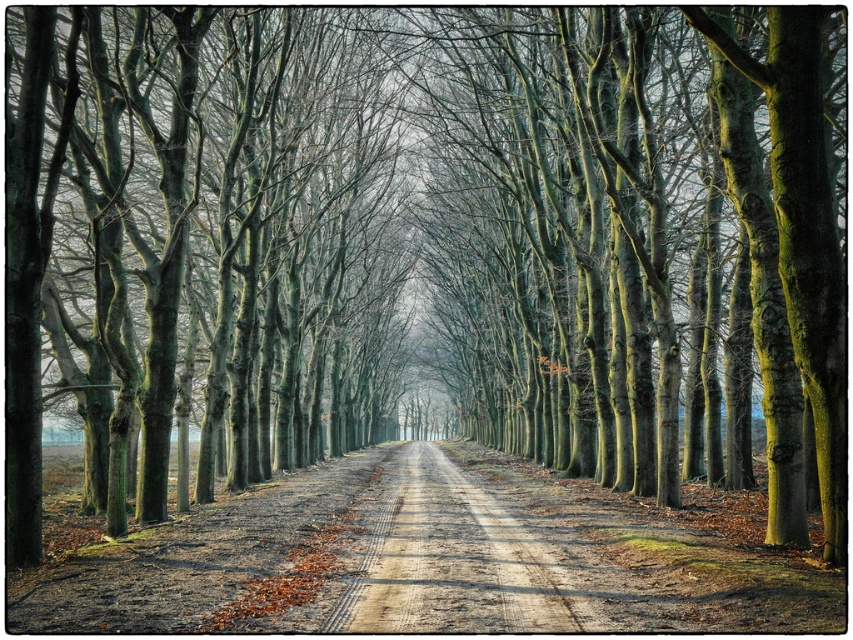
You are standing on the tree lined path and want to walk towards the point that is closer to you. Which point should you walk towards, point (376, 324) or point (393, 593)?

Point (393, 593) is closer to you, so you should walk towards point (393, 593).

You are standing at the origin point of the coordinate system. You want to walk to the smooth bark trees at center. In which direction should you walk?

The smooth bark trees at center are located at coordinate point [193,240]. Since the origin is at the bottom left corner of the image, you should walk northeast to reach them.